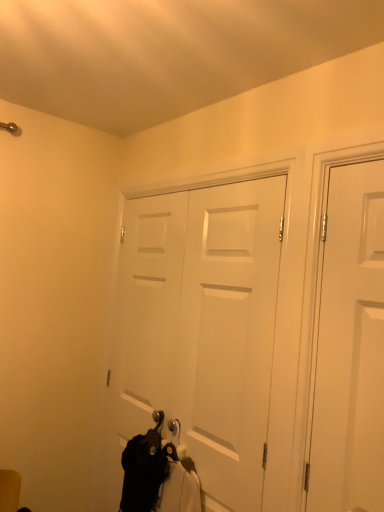
Question: Considering the relative sizes of black fabric at lower center and white matte door at center, marked as the first door in a back-to-front arrangement, in the image provided, is black fabric at lower center shorter than white matte door at center, marked as the first door in a back-to-front arrangement,?

Choices:
 (A) yes
 (B) no

Answer: (A)

Question: Does black fabric at lower center turn towards white matte door at center, the 2th door from the front?

Choices:
 (A) yes
 (B) no

Answer: (B)

Question: Is black fabric at lower center next to white matte door at center, marked as the first door in a back-to-front arrangement?

Choices:
 (A) no
 (B) yes

Answer: (A)

Question: Considering the relative sizes of black fabric at lower center and white matte door at center, acting as the 2th door starting from the right, in the image provided, is black fabric at lower center bigger than white matte door at center, acting as the 2th door starting from the right,?

Choices:
 (A) yes
 (B) no

Answer: (B)

Question: Considering the relative sizes of black fabric at lower center and white matte door at center, acting as the 2th door starting from the right, in the image provided, is black fabric at lower center smaller than white matte door at center, acting as the 2th door starting from the right,?

Choices:
 (A) no
 (B) yes

Answer: (B)

Question: Is black fabric at lower center further to camera compared to white matte door at center, acting as the 2th door starting from the right?

Choices:
 (A) yes
 (B) no

Answer: (B)

Question: Does white matte door at right, the second door when ordered from left to right, touch white matte door at center, marked as the first door in a back-to-front arrangement?

Choices:
 (A) yes
 (B) no

Answer: (B)

Question: Is white matte door at right, the 2th door from the back, smaller than white matte door at center, marked as the first door in a back-to-front arrangement?

Choices:
 (A) yes
 (B) no

Answer: (A)

Question: Is the depth of white matte door at right, the 2th door from the back, greater than that of white matte door at center, acting as the 2th door starting from the right?

Choices:
 (A) yes
 (B) no

Answer: (B)

Question: From a real-world perspective, is white matte door at right, the 2th door from the back, over white matte door at center, the 2th door from the front?

Choices:
 (A) no
 (B) yes

Answer: (B)

Question: Is there a large distance between white matte door at right, the 2th door from the back, and white matte door at center, acting as the 2th door starting from the right?

Choices:
 (A) yes
 (B) no

Answer: (B)

Question: From the image's perspective, is white matte door at right, the 2th door from the back, above white matte door at center, the 2th door from the front?

Choices:
 (A) yes
 (B) no

Answer: (A)

Question: Is white matte door at center, marked as the first door in a back-to-front arrangement, positioned beyond the bounds of black fabric at lower center?

Choices:
 (A) no
 (B) yes

Answer: (B)